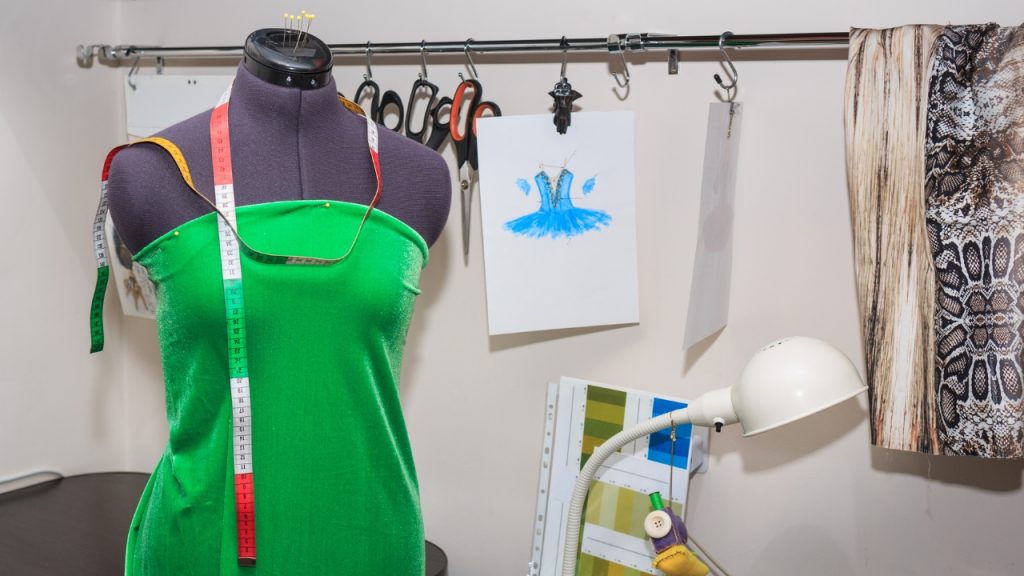
The image size is (1024, 576). I want to click on table lamp, so click(774, 382).